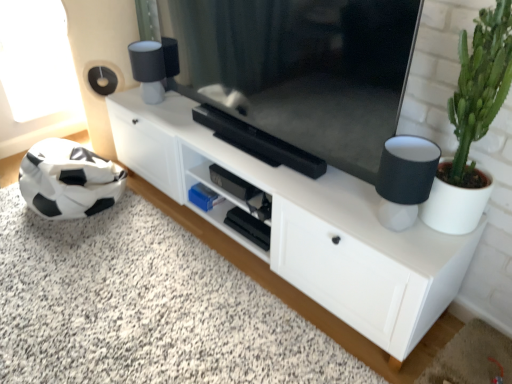
Question: Is green succulent at right taller or shorter than white matte cabinet at center?

Choices:
 (A) short
 (B) tall

Answer: (B)

Question: Choose the correct answer: Is green succulent at right inside white matte cabinet at center or outside it?

Choices:
 (A) inside
 (B) outside

Answer: (B)

Question: Estimate the real-world distances between objects in this image. Which object is farther from the green succulent at right?

Choices:
 (A) black matte soccer ball at lower left
 (B) white matte cabinet at center
 (C) black fabric lampshade at right
 (D) matte black television at center

Answer: (A)

Question: Estimate the real-world distances between objects in this image. Which object is farther from the black fabric lampshade at right?

Choices:
 (A) black matte soccer ball at lower left
 (B) white matte cabinet at center
 (C) green succulent at right
 (D) matte black television at center

Answer: (A)